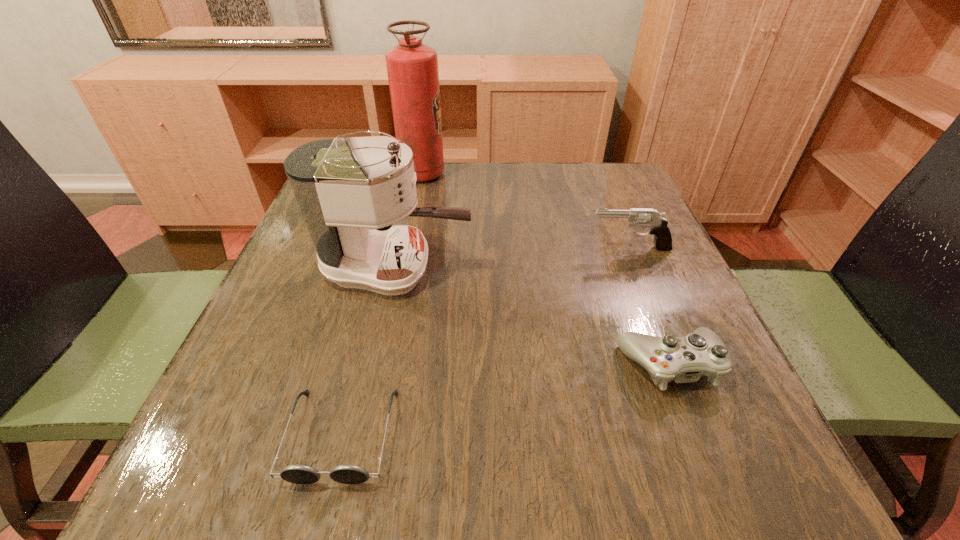
The image size is (960, 540). Find the location of `fire extinguisher`. fire extinguisher is located at coordinates (412, 67).

The width and height of the screenshot is (960, 540). I want to click on the tallest object, so click(x=412, y=67).

Locate an element on the screen. coffee maker is located at coordinates (344, 187).

Locate an element on the screen. the third shortest object is located at coordinates (644, 217).

Find the location of a particular element. The width and height of the screenshot is (960, 540). the second shortest object is located at coordinates (684, 359).

Find the location of a particular element. sunglasses is located at coordinates (298, 474).

Identify the location of vacant position located on the label side of the farthest object. Image resolution: width=960 pixels, height=540 pixels. (515, 174).

Locate an element on the screen. Image resolution: width=960 pixels, height=540 pixels. vacant space situated on the front-facing side of the fourth shortest object is located at coordinates (560, 267).

Locate an element on the screen. Image resolution: width=960 pixels, height=540 pixels. vacant space located 0.120m at the muzzle of the third shortest object is located at coordinates (534, 248).

At what (x,y) coordinates should I click in order to perform the action: click on free space located at the muzzle of the third shortest object. Please return your answer as a coordinate pair (x, y). This screenshot has width=960, height=540. Looking at the image, I should click on (465, 248).